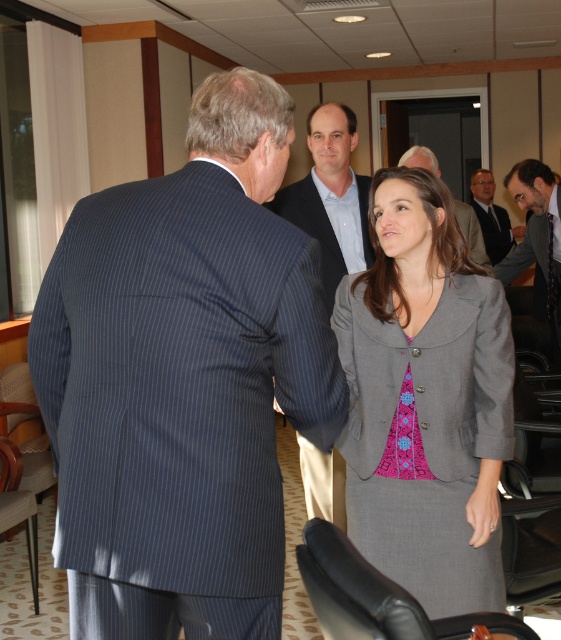
You are standing in the conference room and see two points marked in the scene. Which point is closer to you, point (x=494, y=273) or point (x=465, y=214)?

Point (x=494, y=273) is closer to you because it is further to the camera than point (x=465, y=214).